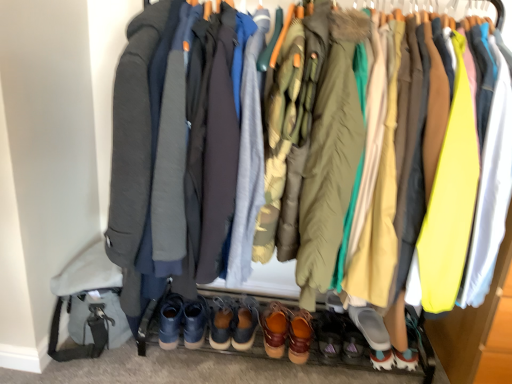
Question: Should I look upward or downward to see brown leather shoe at center, which ranks as the 5th footwear in left-to-right order?

Choices:
 (A) up
 (B) down

Answer: (B)

Question: From a real-world perspective, is matte gray jacket at center, arranged as the second jacket when viewed from the right, located beneath brown leather shoe at center, which ranks as the 5th footwear in left-to-right order?

Choices:
 (A) no
 (B) yes

Answer: (A)

Question: Does matte gray jacket at center, arranged as the second jacket when viewed from the right, appear on the right side of brown leather shoe at center, which ranks as the 5th footwear in left-to-right order?

Choices:
 (A) no
 (B) yes

Answer: (A)

Question: Considering the relative sizes of matte gray jacket at center, which ranks as the first jacket in left-to-right order, and brown leather shoe at center, which ranks as the 5th footwear in left-to-right order, in the image provided, is matte gray jacket at center, which ranks as the first jacket in left-to-right order, shorter than brown leather shoe at center, which ranks as the 5th footwear in left-to-right order,?

Choices:
 (A) yes
 (B) no

Answer: (B)

Question: Could you tell me if matte gray jacket at center, which ranks as the first jacket in left-to-right order, is turned towards brown leather shoe at center, the 3th footwear in the right-to-left sequence?

Choices:
 (A) yes
 (B) no

Answer: (A)

Question: From a real-world perspective, is matte gray jacket at center, arranged as the second jacket when viewed from the right, positioned over brown leather shoe at center, which ranks as the 5th footwear in left-to-right order, based on gravity?

Choices:
 (A) no
 (B) yes

Answer: (B)

Question: Are matte gray jacket at center, which ranks as the first jacket in left-to-right order, and brown leather shoe at center, the 3th footwear in the right-to-left sequence, located far from each other?

Choices:
 (A) yes
 (B) no

Answer: (A)

Question: From a real-world perspective, is brown leather shoes at center, which appears as the fifth footwear when viewed from the right, below leather boots at lower center, the 4th footwear when ordered from right to left?

Choices:
 (A) no
 (B) yes

Answer: (A)

Question: Is brown leather shoes at center, which appears as the fifth footwear when viewed from the right, facing towards leather boots at lower center, the 4th footwear when ordered from right to left?

Choices:
 (A) no
 (B) yes

Answer: (A)

Question: Is brown leather shoes at center, which appears as the fifth footwear when viewed from the right, far from leather boots at lower center, which appears as the 4th footwear when viewed from the left?

Choices:
 (A) yes
 (B) no

Answer: (B)

Question: From a real-world perspective, does brown leather shoes at center, which appears as the fifth footwear when viewed from the right, stand above leather boots at lower center, which appears as the 4th footwear when viewed from the left?

Choices:
 (A) yes
 (B) no

Answer: (A)

Question: Can you confirm if brown leather shoes at center, which appears as the fifth footwear when viewed from the right, is shorter than leather boots at lower center, which appears as the 4th footwear when viewed from the left?

Choices:
 (A) no
 (B) yes

Answer: (A)

Question: Is brown leather shoes at center, which appears as the fifth footwear when viewed from the right, looking in the opposite direction of leather boots at lower center, the 4th footwear when ordered from right to left?

Choices:
 (A) yes
 (B) no

Answer: (B)

Question: Are brown suede shoes at center, the seventh footwear viewed from the right, and gray rubber slipper at lower center, the seventh footwear from the left, far apart?

Choices:
 (A) no
 (B) yes

Answer: (A)